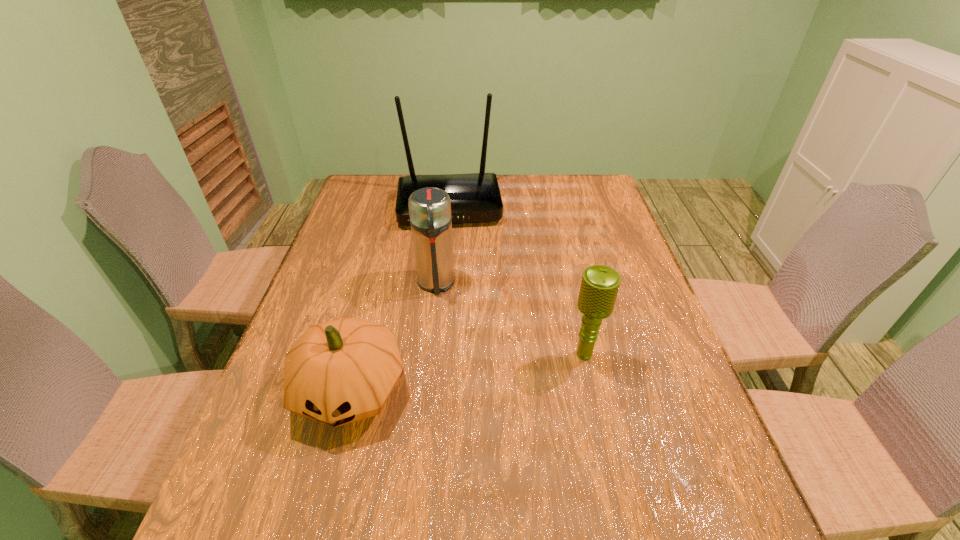
Locate an element on the screen. The image size is (960, 540). vacant space on the desktop that is between the shortest object and the microphone and is positioned on the front-facing side of the tallest object is located at coordinates (459, 374).

You are a GUI agent. You are given a task and a screenshot of the screen. Output one action in this format:
    pyautogui.click(x=<x>, y=<y>)
    Task: Click on the vacant space on the desktop that is between the shortest object and the microphone and is positioned with a handle on the side of the second farthest object
    The height and width of the screenshot is (540, 960).
    Given the screenshot: What is the action you would take?
    pyautogui.click(x=442, y=376)